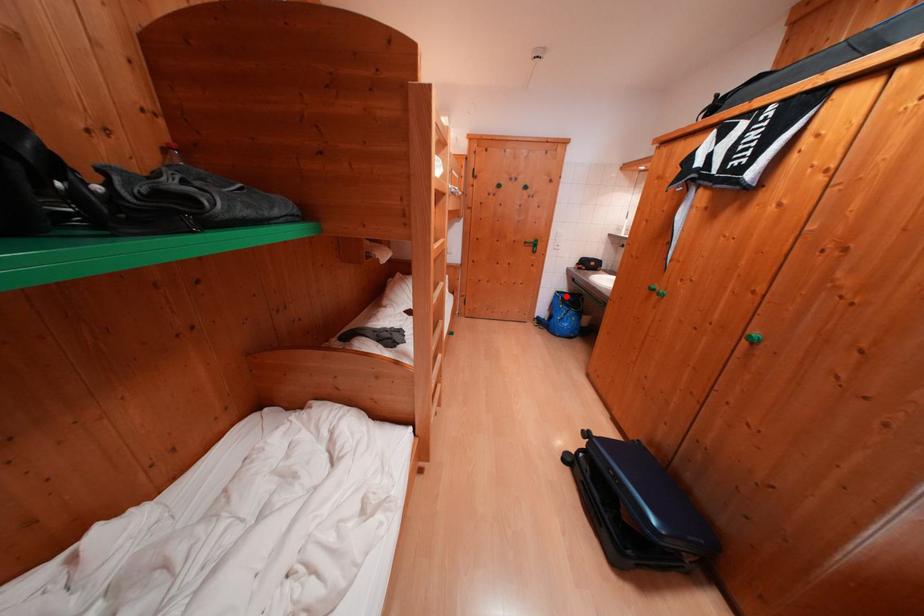
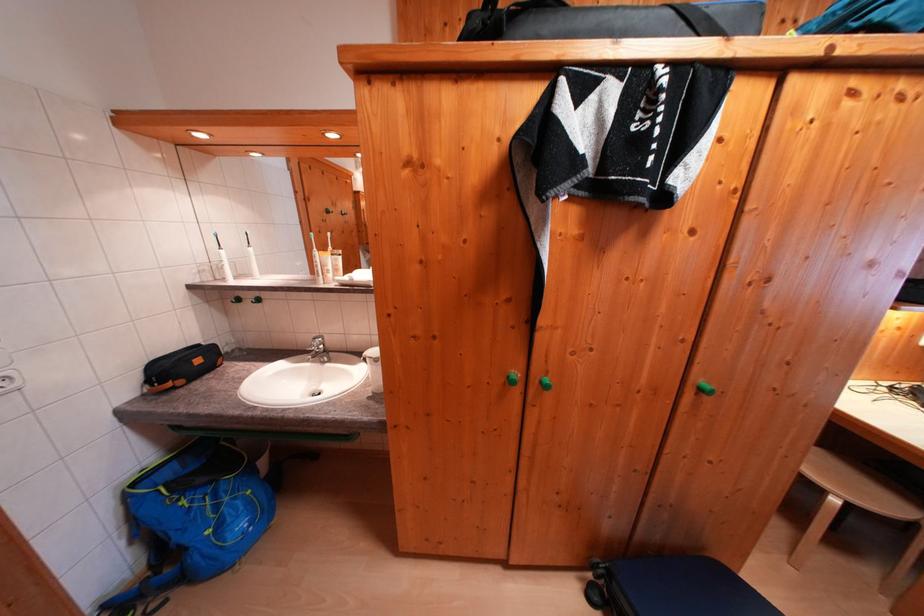
Question: I am providing you with two images of the same scene from different viewpoints. Image1 has a red point marked. In image2, the corresponding 3D location appears at what relative position? Reply with the corresponding letter.

Choices:
 (A) Closer
 (B) Farther

Answer: (B)